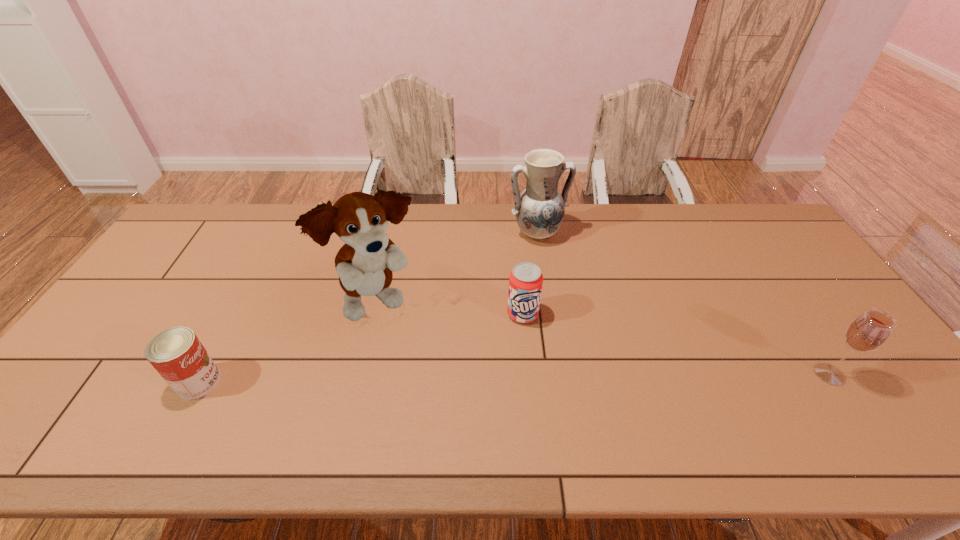
Locate an element on the screen. This screenshot has width=960, height=540. can located at the near edge is located at coordinates (177, 354).

Image resolution: width=960 pixels, height=540 pixels. Identify the location of wineglass that is positioned at the near edge. (868, 332).

Identify the location of object that is at the right edge. The width and height of the screenshot is (960, 540). (868, 332).

What are the coordinates of `object that is positioned at the near right corner` in the screenshot? It's located at (868, 332).

Where is `vacant area at the far edge`? vacant area at the far edge is located at coordinates (462, 206).

Locate an element on the screen. The width and height of the screenshot is (960, 540). free space at the near edge is located at coordinates (617, 408).

Image resolution: width=960 pixels, height=540 pixels. I want to click on vacant space at the left edge of the desktop, so click(67, 380).

The image size is (960, 540). Identify the location of blank space at the right edge. (787, 284).

This screenshot has width=960, height=540. I want to click on free location at the far left corner of the desktop, so click(x=235, y=204).

The height and width of the screenshot is (540, 960). In the image, there is a desktop. Identify the location of vacant space at the far right corner. point(741,204).